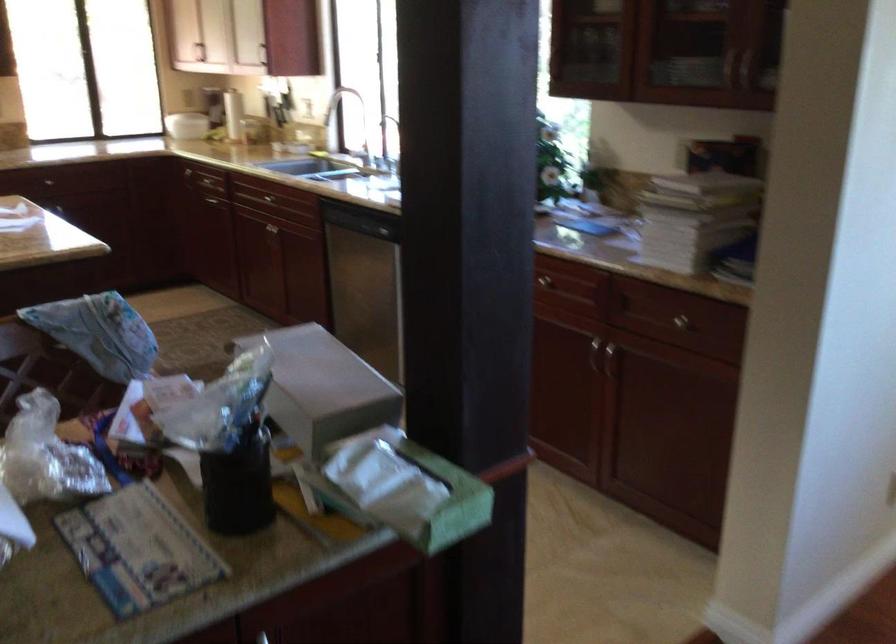
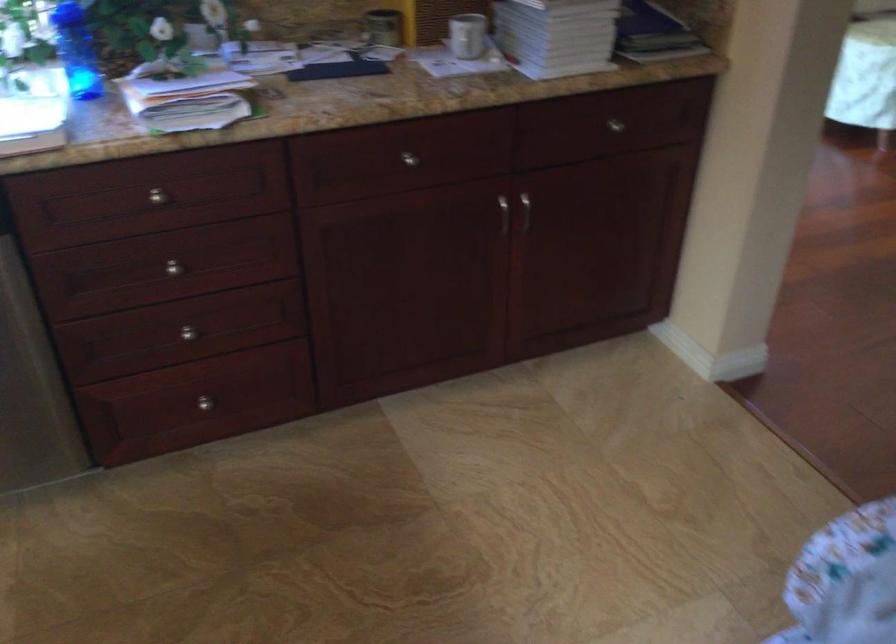
Locate, in the second image, the point that corresponds to point 647,228 in the first image.

(467, 35)